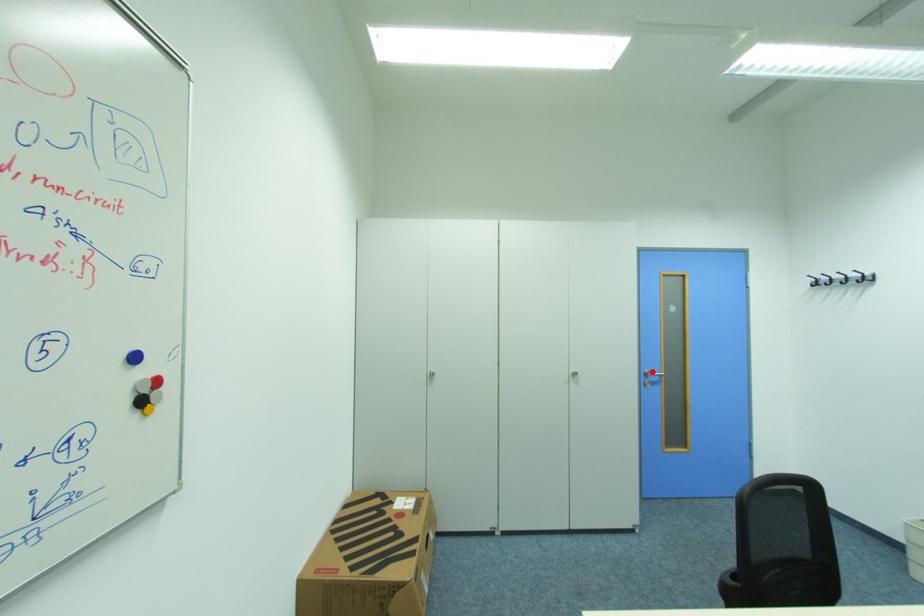
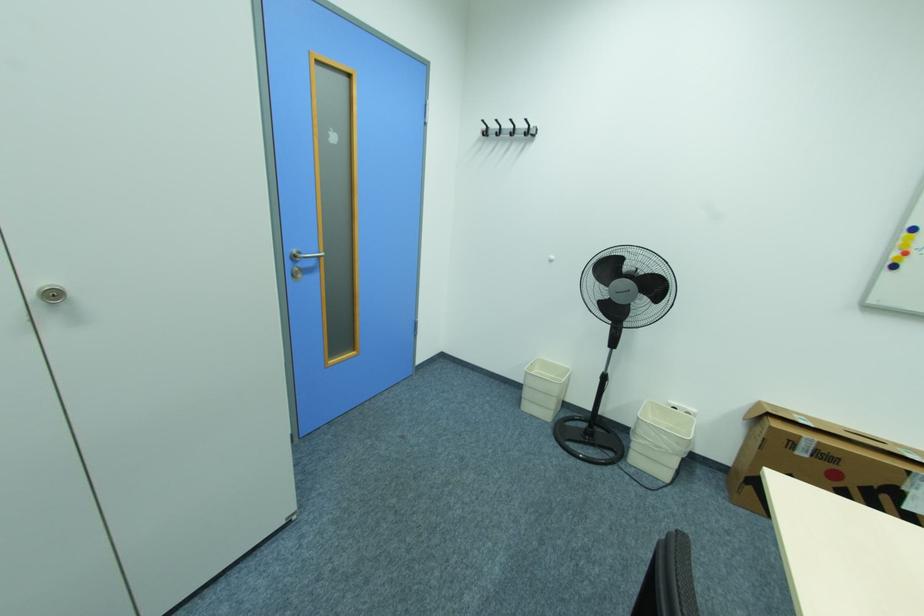
The point at the highlighted location is marked in the first image. Where is the corresponding point in the second image?

(300, 252)